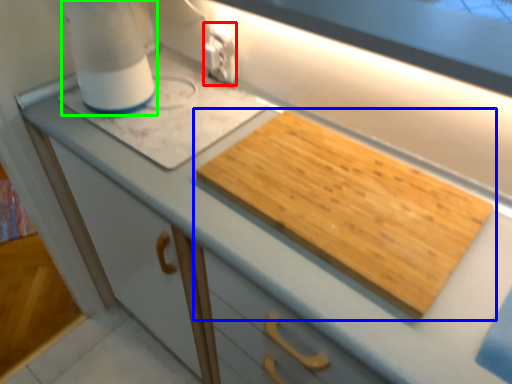
Question: Which is farther away from electric outlet (highlighted by a red box)? cutting board (highlighted by a blue box) or blender (highlighted by a green box)?

Choices:
 (A) cutting board
 (B) blender

Answer: (A)